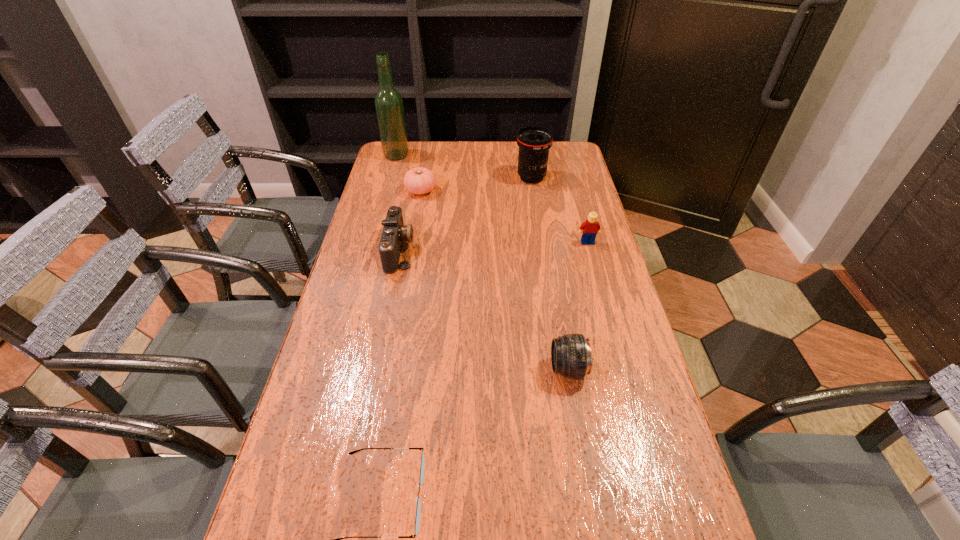
The image size is (960, 540). Find the location of `vacant space located 0.120m on the left of the second tallest object`. vacant space located 0.120m on the left of the second tallest object is located at coordinates (483, 178).

You are a GUI agent. You are given a task and a screenshot of the screen. Output one action in this format:
    pyautogui.click(x=<x>, y=<y>)
    Task: Click on the free space located on the front-facing side of the rightmost object
    
    Given the screenshot: What is the action you would take?
    pyautogui.click(x=595, y=269)

The width and height of the screenshot is (960, 540). In order to click on free spot located on the front-facing side of the camera in this screenshot , I will do `click(485, 250)`.

What are the coordinates of `vacant space situated at the front element of the nearer telephoto lens` in the screenshot? It's located at (514, 369).

Where is `vacant area situated 0.080m at the front element of the nearer telephoto lens`? vacant area situated 0.080m at the front element of the nearer telephoto lens is located at coordinates (518, 369).

Locate an element on the screen. free space located 0.350m at the front element of the nearer telephoto lens is located at coordinates (406, 369).

The height and width of the screenshot is (540, 960). Find the location of `free point located 0.310m on the front of the tomato`. free point located 0.310m on the front of the tomato is located at coordinates (409, 257).

Identify the location of liquor that is at the far edge. The image size is (960, 540). (389, 108).

Locate an element on the screen. Image resolution: width=960 pixels, height=540 pixels. telephoto lens positioned at the far edge is located at coordinates (534, 142).

The height and width of the screenshot is (540, 960). What are the coordinates of `liquor at the left edge` in the screenshot? It's located at pos(389,108).